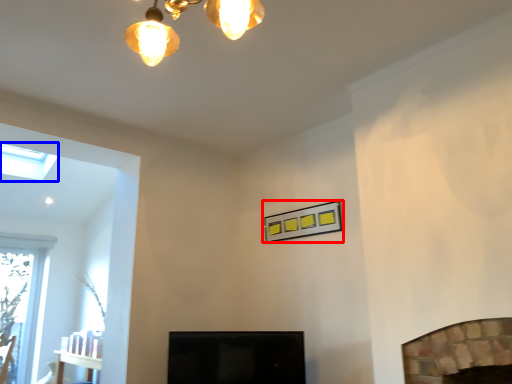
Question: Which object is closer to the camera taking this photo, picture frame (highlighted by a red box) or lamp (highlighted by a blue box)?

Choices:
 (A) picture frame
 (B) lamp

Answer: (A)